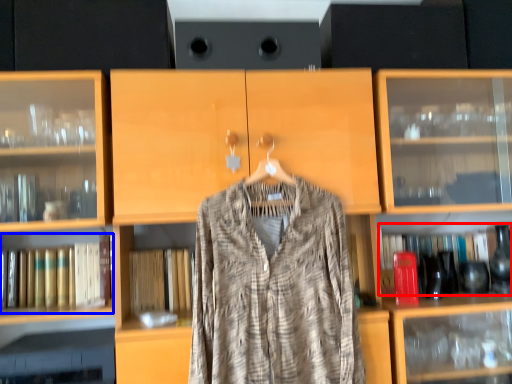
Question: Among these objects, which one is nearest to the camera, book (highlighted by a red box) or book (highlighted by a blue box)?

Choices:
 (A) book
 (B) book

Answer: (B)